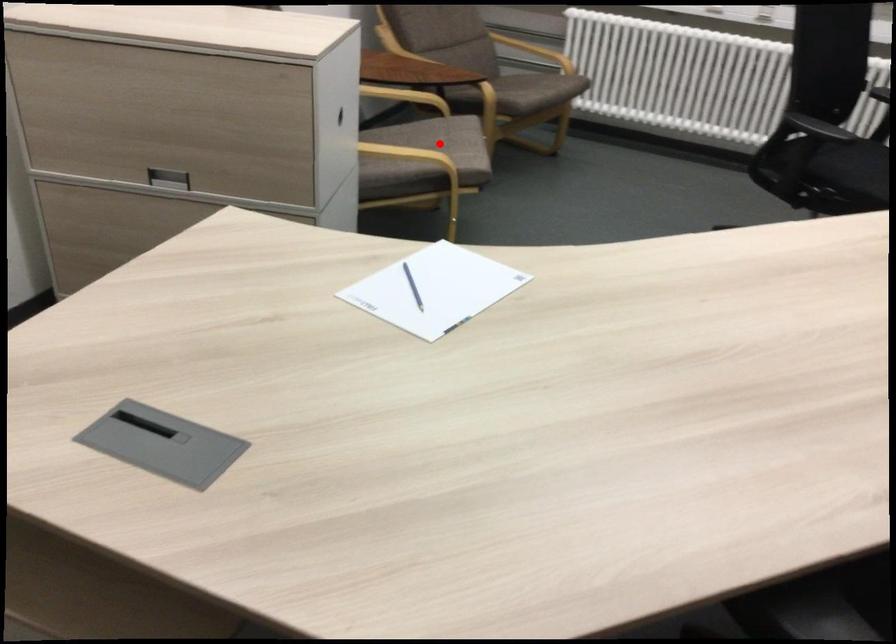
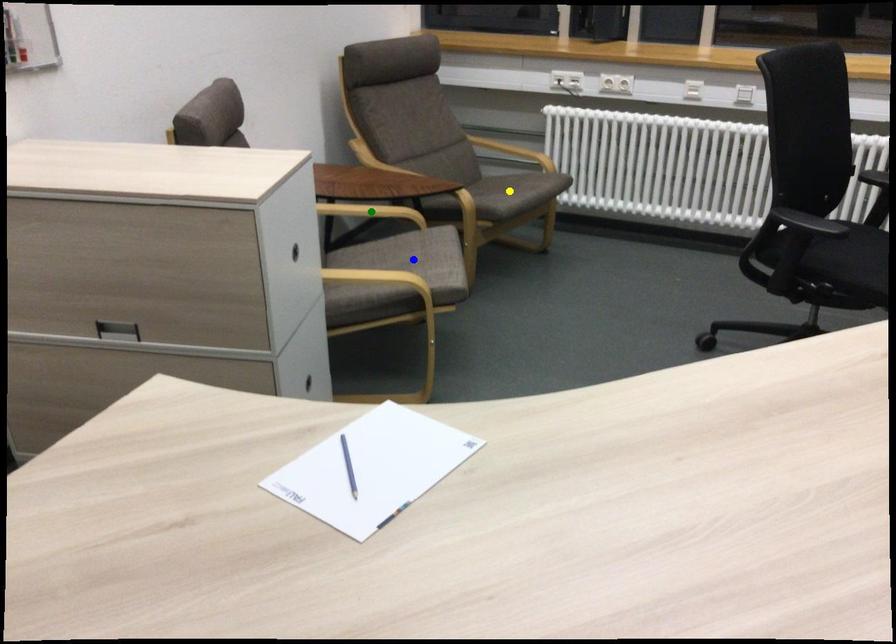
Question: I am providing you with two images of the same scene from different viewpoints. A red point is marked on the first image. You are given multiple points on the second image. In image 2, which mark is for the same physical point as the one in image 1?

Choices:
 (A) yellow point
 (B) blue point
 (C) green point

Answer: (B)